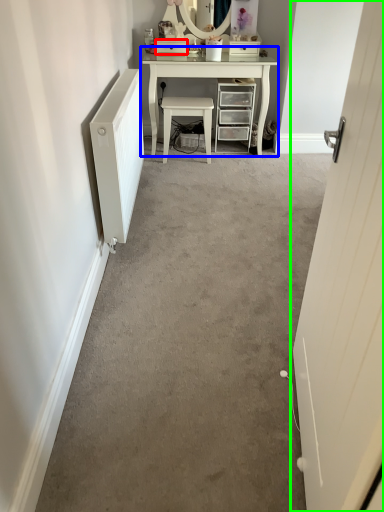
Question: Which is farther away from drawer (highlighted by a red box)? table (highlighted by a blue box) or door (highlighted by a green box)?

Choices:
 (A) table
 (B) door

Answer: (B)